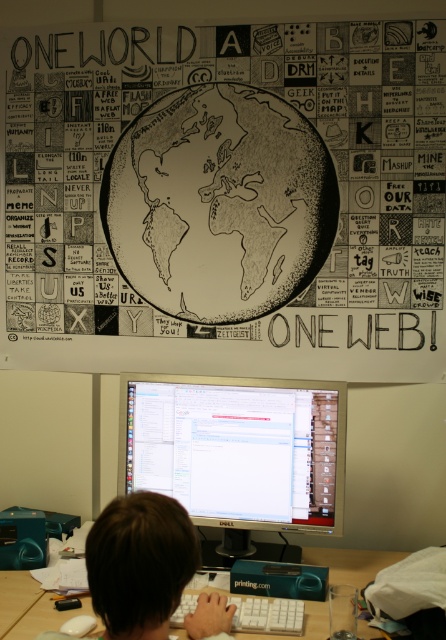
You are a photographer adjusting your camera to focus on two points in the workspace scene. The first point is at coordinates point (149, 237) and the second is at point (12, 637). Since both points are in focus, which point would require the camera to be focused closer to you?

Point (12, 637) is closer to the camera than point (149, 237), so the camera should focus closer to you for that point.

What is the relationship between the size of the black and white drawing of earth at upper center and the white plastic keyboard at center?

The black and white drawing of earth at upper center is larger in size compared to the white plastic keyboard at center.

What is the relationship between the size of the black and white drawing of earth at upper center and the wooden at lower center?

The black and white drawing of earth at upper center is larger in width than the wooden at lower center.